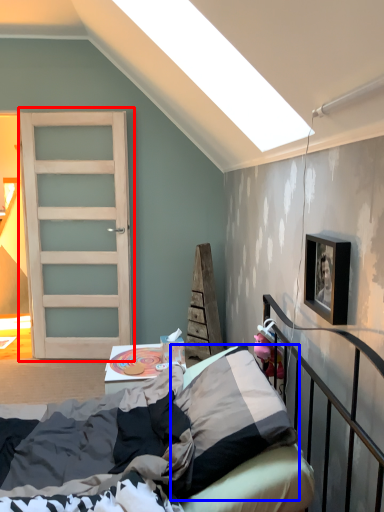
Question: Which object is further to the camera taking this photo, door (highlighted by a red box) or pillow (highlighted by a blue box)?

Choices:
 (A) door
 (B) pillow

Answer: (A)